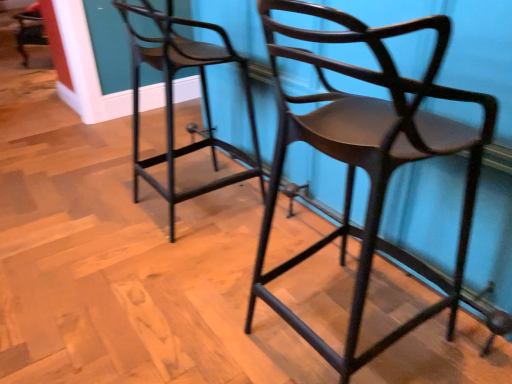
Locate an element on the screen. This screenshot has width=512, height=384. vacant space underneath matte dark wood chair at center, the 1th chair viewed from the right (from a real-world perspective) is located at coordinates (362, 313).